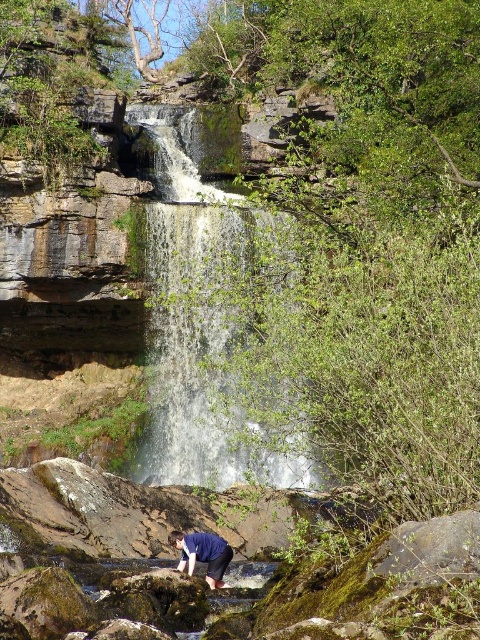
Based on the photo, you are standing at the edge of the waterfall and want to reach the blue fabric shirt at lower center without getting your feet wet. The white frothy water at center is in your path. Which direction should you move to avoid stepping into the water?

You should move to the right to avoid the white frothy water at center, as it is located to the left of the blue fabric shirt at lower center.

You are a hiker who wants to cross the stream at the base of the waterfall. You see the white frothy water at center and the blue fabric shirt at lower center. Which object is closer to you as you approach the stream?

The white frothy water at center is closer to you because it is in front of the blue fabric shirt at lower center.

Based on the photo, you are a hiker who wants to cross the stream at the base of the waterfall. You see the white frothy water at center and the blue fabric shirt at lower center. Which object is closer to the water surface?

The white frothy water at center is above the blue fabric shirt at lower center, so the white frothy water at center is closer to the water surface.